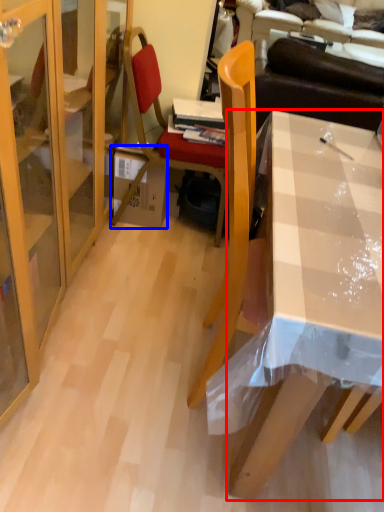
Question: Which point is further to the camera, desk (highlighted by a red box) or box (highlighted by a blue box)?

Choices:
 (A) desk
 (B) box

Answer: (B)